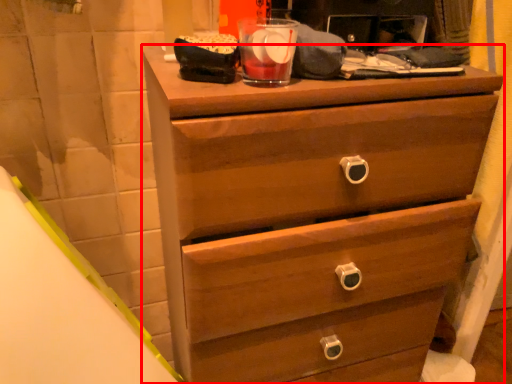
Question: Observing the image, what is the correct spatial positioning of chest of drawers (annotated by the red box) in reference to beverage?

Choices:
 (A) left
 (B) right

Answer: (B)